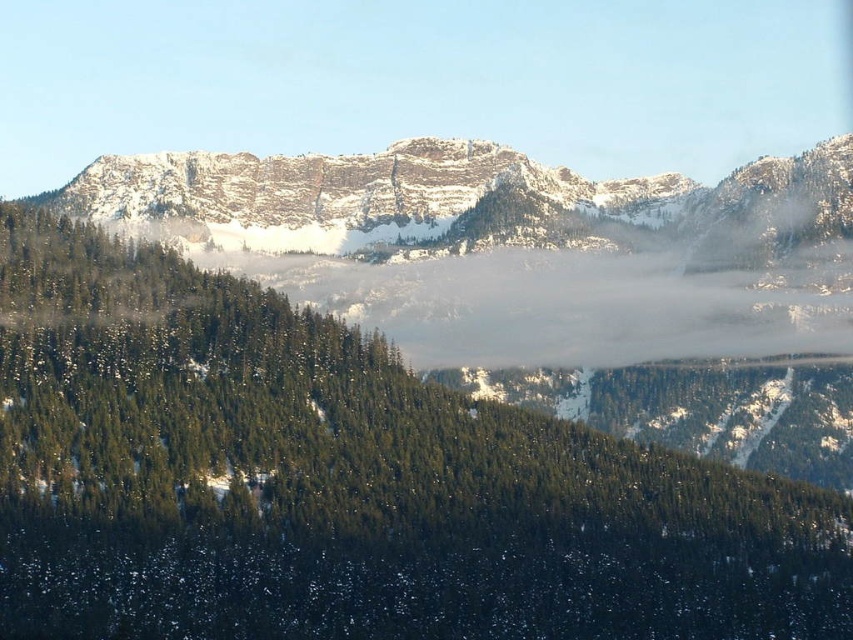
Which of these two, green matte tree at center or snowy rock formation at center, stands shorter?

Standing shorter between the two is snowy rock formation at center.

Where is `green matte tree at center`? The height and width of the screenshot is (640, 853). green matte tree at center is located at coordinates (344, 483).